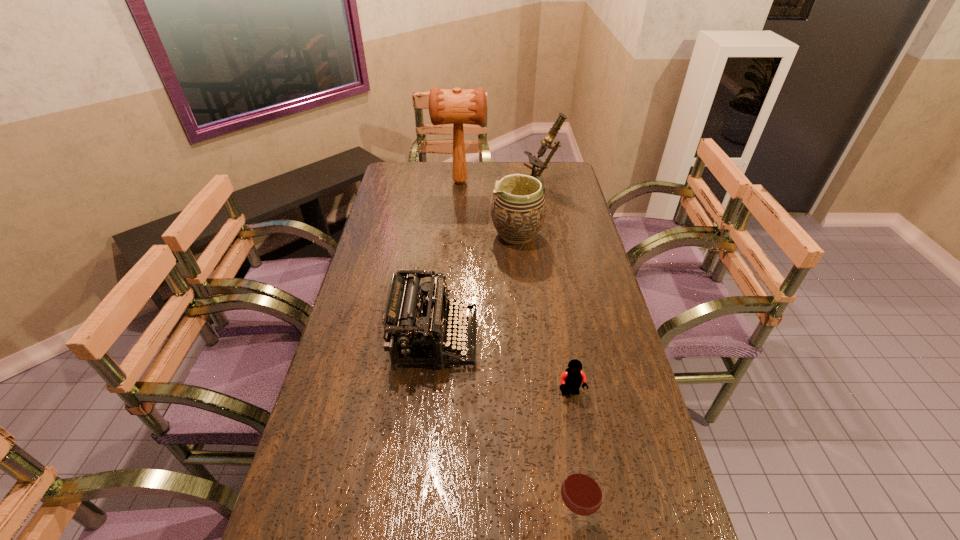
The height and width of the screenshot is (540, 960). Identify the location of microscope at the right edge. (536, 163).

Locate an element on the screen. This screenshot has height=540, width=960. Lego that is at the right edge is located at coordinates (571, 380).

Locate an element on the screen. object situated at the far right corner is located at coordinates (536, 163).

This screenshot has width=960, height=540. In order to click on vacant space at the left edge of the desktop in this screenshot , I will do (x=365, y=296).

What are the coordinates of `free region at the right edge` in the screenshot? It's located at (639, 510).

Where is `blank space at the far left corner of the desktop`? This screenshot has height=540, width=960. blank space at the far left corner of the desktop is located at coordinates (407, 171).

Image resolution: width=960 pixels, height=540 pixels. In order to click on free area in between the typewriter and the microscope in this screenshot , I will do pos(488,262).

This screenshot has height=540, width=960. What are the coordinates of `vacant space in between the fourth shortest object and the fifth tallest object` in the screenshot? It's located at (545, 376).

Where is `vacant area that lies between the Lego and the pottery`? vacant area that lies between the Lego and the pottery is located at coordinates (543, 314).

Locate an element on the screen. The height and width of the screenshot is (540, 960). vacant space in between the fourth shortest object and the nearest object is located at coordinates (545, 376).